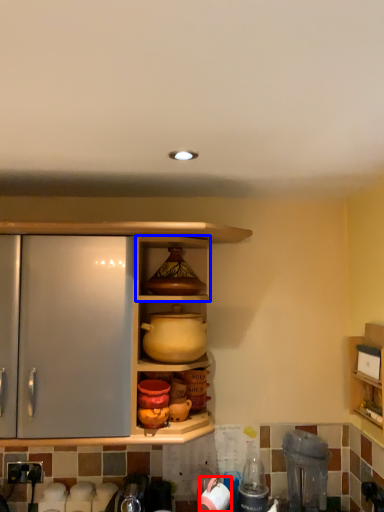
Question: Among these objects, which one is nearest to the camera, appliance (highlighted by a red box) or cabinet (highlighted by a blue box)?

Choices:
 (A) appliance
 (B) cabinet

Answer: (B)